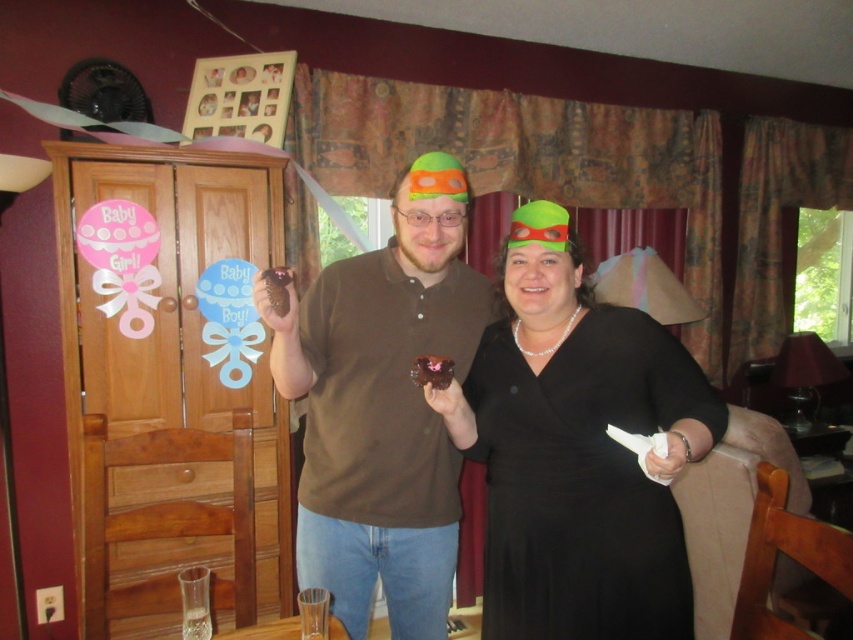
You are a photographer at the baby shower and need to take a photo of the brown matte shirt at center and the brown matte cupcake at center. Which object should you focus on first if you want to capture both in the same frame without moving the camera?

The brown matte shirt at center is much taller than the brown matte cupcake at center, so you should focus on the brown matte shirt at center first to ensure it is in focus before the cupcake.

You are at a baby shower and want to place a small decoration between the two points marked as point (344,611) and point (260,276). Which point should the decoration be closer to in order to appear closer to the viewer?

The decoration should be closer to point (344,611) because it is further to the viewer than point (260,276).